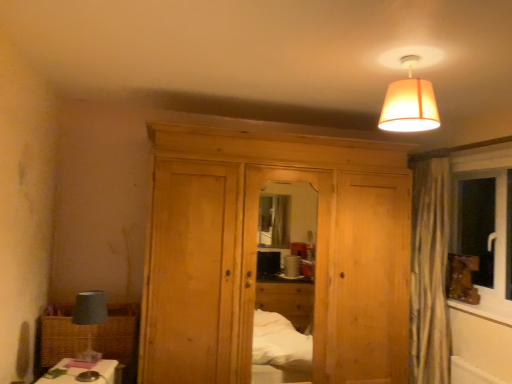
Based on the photo, what is the approximate height of natural wood dresser at center?

It is 6.39 feet.

Identify the location of wooden frame at right. (480, 312).

Where is `matte gray lampshade at left`? The height and width of the screenshot is (384, 512). matte gray lampshade at left is located at coordinates (90, 308).

This screenshot has height=384, width=512. What do you see at coordinates (90, 308) in the screenshot? I see `matte gray lampshade at left` at bounding box center [90, 308].

The width and height of the screenshot is (512, 384). Find the location of `woven brown picnic basket at lower left`. woven brown picnic basket at lower left is located at coordinates (87, 338).

From a real-world perspective, is natural wood dresser at center positioned under matte gray lampshade at left based on gravity?

No, from a real-world perspective, natural wood dresser at center is not below matte gray lampshade at left.

How far apart are natural wood dresser at center and matte gray lampshade at left?

A distance of 3.57 feet exists between natural wood dresser at center and matte gray lampshade at left.

Considering the sizes of objects natural wood dresser at center and matte gray lampshade at left in the image provided, who is wider, natural wood dresser at center or matte gray lampshade at left?

natural wood dresser at center is wider.

Which object is further away from the camera, natural wood dresser at center or matte gray lampshade at left?

natural wood dresser at center is more distant.

Is point (407, 81) positioned in front of point (501, 319)?

Yes, point (407, 81) is in front of point (501, 319).

Do you think orange fabric lampshade at upper center is within wooden frame at right, or outside of it?

orange fabric lampshade at upper center exists outside the volume of wooden frame at right.

How distant is orange fabric lampshade at upper center from wooden frame at right?

orange fabric lampshade at upper center is 1.64 meters away from wooden frame at right.

Is orange fabric lampshade at upper center placed right next to wooden frame at right?

There is a gap between orange fabric lampshade at upper center and wooden frame at right.

You are a GUI agent. You are given a task and a screenshot of the screen. Output one action in this format:
    pyautogui.click(x=<x>, y=<y>)
    Task: Click on the picnic basket behind the wooden frame at right
    This screenshot has width=512, height=384.
    Given the screenshot: What is the action you would take?
    pyautogui.click(x=87, y=338)

Can you confirm if woven brown picnic basket at lower left is shorter than wooden frame at right?

No.

Is woven brown picnic basket at lower left facing away from wooden frame at right?

No, wooden frame at right is not at the back of woven brown picnic basket at lower left.

Which of these two, woven brown picnic basket at lower left or wooden frame at right, is bigger?

woven brown picnic basket at lower left is bigger.

Locate an element on the screen. The width and height of the screenshot is (512, 384). dresser above the woven brown picnic basket at lower left (from a real-world perspective) is located at coordinates (256, 254).

From the image's perspective, would you say natural wood dresser at center is shown under woven brown picnic basket at lower left?

No, from the image's perspective, natural wood dresser at center is not beneath woven brown picnic basket at lower left.

Is natural wood dresser at center taller than woven brown picnic basket at lower left?

Correct, natural wood dresser at center is much taller as woven brown picnic basket at lower left.

Is natural wood dresser at center positioned with its back to woven brown picnic basket at lower left?

natural wood dresser at center is not turned away from woven brown picnic basket at lower left.

In the image, is orange fabric lampshade at upper center positioned in front of or behind woven brown picnic basket at lower left?

In the image, orange fabric lampshade at upper center appears in front of woven brown picnic basket at lower left.

Considering the relative sizes of orange fabric lampshade at upper center and woven brown picnic basket at lower left in the image provided, is orange fabric lampshade at upper center taller than woven brown picnic basket at lower left?

In fact, orange fabric lampshade at upper center may be shorter than woven brown picnic basket at lower left.

In terms of width, does orange fabric lampshade at upper center look wider or thinner when compared to woven brown picnic basket at lower left?

orange fabric lampshade at upper center is thinner than woven brown picnic basket at lower left.

Between point (421, 59) and point (120, 346), which one is positioned in front?

The point (421, 59) is closer.

Between woven brown picnic basket at lower left and natural wood dresser at center, which one has smaller size?

Smaller between the two is woven brown picnic basket at lower left.

Would you say woven brown picnic basket at lower left is a long distance from natural wood dresser at center?

No, woven brown picnic basket at lower left is not far from natural wood dresser at center.

Does woven brown picnic basket at lower left contain natural wood dresser at center?

No, natural wood dresser at center is not a part of woven brown picnic basket at lower left.

From the image's perspective, which object appears higher, woven brown picnic basket at lower left or natural wood dresser at center?

natural wood dresser at center.

From a real-world perspective, is matte gray lampshade at left above or below wooden frame at right?

From a real-world perspective, matte gray lampshade at left is physically below wooden frame at right.

How different are the orientations of matte gray lampshade at left and wooden frame at right in degrees?

170 degrees.

Could you tell me if matte gray lampshade at left is facing wooden frame at right?

Yes, matte gray lampshade at left is aimed at wooden frame at right.

Which of these two, matte gray lampshade at left or wooden frame at right, stands taller?

matte gray lampshade at left.

At what (x,y) coordinates should I click in order to perform the action: click on table lamp below the natural wood dresser at center (from a real-world perspective). Please return your answer as a coordinate pair (x, y). This screenshot has width=512, height=384. Looking at the image, I should click on (90, 308).

Where is `window sill below the orange fabric lampshade at upper center (from the image's perspective)`? window sill below the orange fabric lampshade at upper center (from the image's perspective) is located at coordinates (480, 312).

Based on their spatial positions, is woven brown picnic basket at lower left or wooden frame at right closer to matte gray lampshade at left?

woven brown picnic basket at lower left is closer to matte gray lampshade at left.

Based on their spatial positions, is natural wood dresser at center or wooden frame at right closer to woven brown picnic basket at lower left?

natural wood dresser at center.

From the image, which object appears to be farther from woven brown picnic basket at lower left, wooden frame at right or orange fabric lampshade at upper center?

Based on the image, wooden frame at right appears to be further to woven brown picnic basket at lower left.

When comparing their distances from natural wood dresser at center, does matte gray lampshade at left or woven brown picnic basket at lower left seem further?

Among the two, matte gray lampshade at left is located further to natural wood dresser at center.

When comparing their distances from wooden frame at right, does matte gray lampshade at left or natural wood dresser at center seem closer?

Among the two, natural wood dresser at center is located nearer to wooden frame at right.

Estimate the real-world distances between objects in this image. Which object is further from orange fabric lampshade at upper center, matte gray lampshade at left or wooden frame at right?

matte gray lampshade at left lies further to orange fabric lampshade at upper center than the other object.

Which object lies further to the anchor point woven brown picnic basket at lower left, wooden frame at right or natural wood dresser at center?

wooden frame at right is further to woven brown picnic basket at lower left.

When comparing their distances from orange fabric lampshade at upper center, does natural wood dresser at center or woven brown picnic basket at lower left seem further?

woven brown picnic basket at lower left lies further to orange fabric lampshade at upper center than the other object.

Find the location of a particular element. dresser located between matte gray lampshade at left and wooden frame at right in the left-right direction is located at coordinates (256, 254).

Locate an element on the screen. The width and height of the screenshot is (512, 384). dresser situated between woven brown picnic basket at lower left and wooden frame at right from left to right is located at coordinates (256, 254).

At what (x,y) coordinates should I click in order to perform the action: click on lamp between matte gray lampshade at left and wooden frame at right in the horizontal direction. Please return your answer as a coordinate pair (x, y). The height and width of the screenshot is (384, 512). Looking at the image, I should click on (409, 102).

I want to click on lamp located between natural wood dresser at center and wooden frame at right in the left-right direction, so click(409, 102).